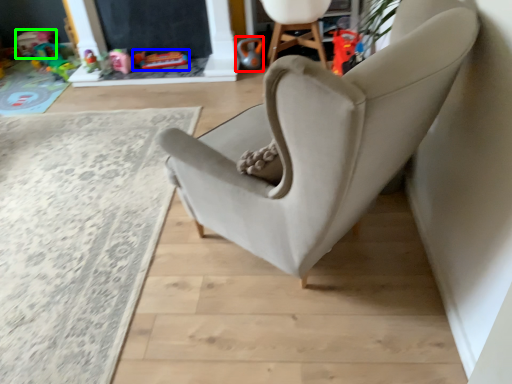
Question: Considering the real-world distances, which object is farthest from toy (highlighted by a red box)? toy (highlighted by a blue box) or toy (highlighted by a green box)?

Choices:
 (A) toy
 (B) toy

Answer: (B)